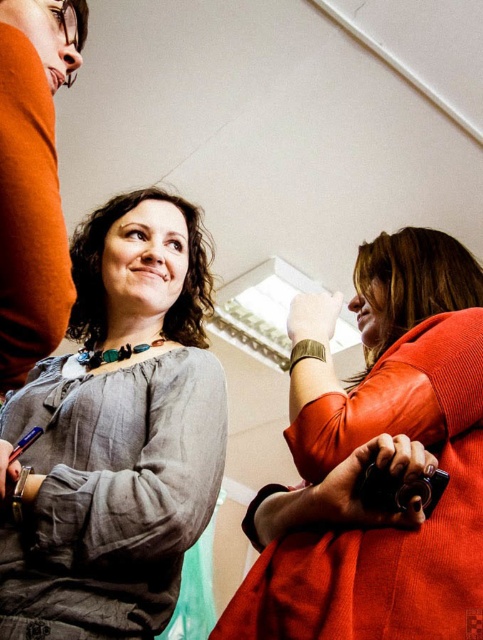
Question: Which point is farther from the camera taking this photo?

Choices:
 (A) (307, 408)
 (B) (12, 216)
 (C) (186, 481)

Answer: (C)

Question: Is matte orange sweater at right to the left of matte orange sweater at left from the viewer's perspective?

Choices:
 (A) no
 (B) yes

Answer: (A)

Question: Which point appears closest to the camera in this image?

Choices:
 (A) (15, 134)
 (B) (424, 538)

Answer: (A)

Question: Which is farther from the matte orange sweater at right?

Choices:
 (A) matte gray blouse at center
 (B) matte orange sweater at left

Answer: (B)

Question: In this image, where is matte gray blouse at center located relative to matte orange sweater at left?

Choices:
 (A) below
 (B) above

Answer: (A)

Question: Can you confirm if matte gray blouse at center is positioned above matte orange sweater at left?

Choices:
 (A) no
 (B) yes

Answer: (A)